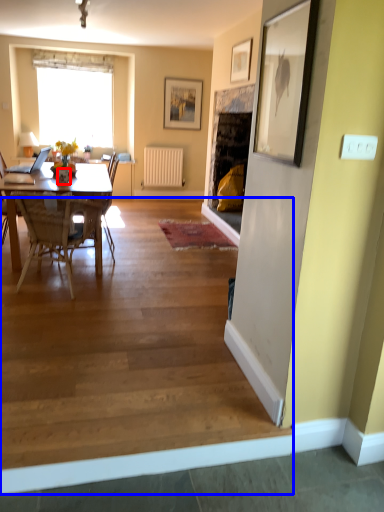
Question: Which point is further to the camera, vase (highlighted by a red box) or stair (highlighted by a blue box)?

Choices:
 (A) vase
 (B) stair

Answer: (A)